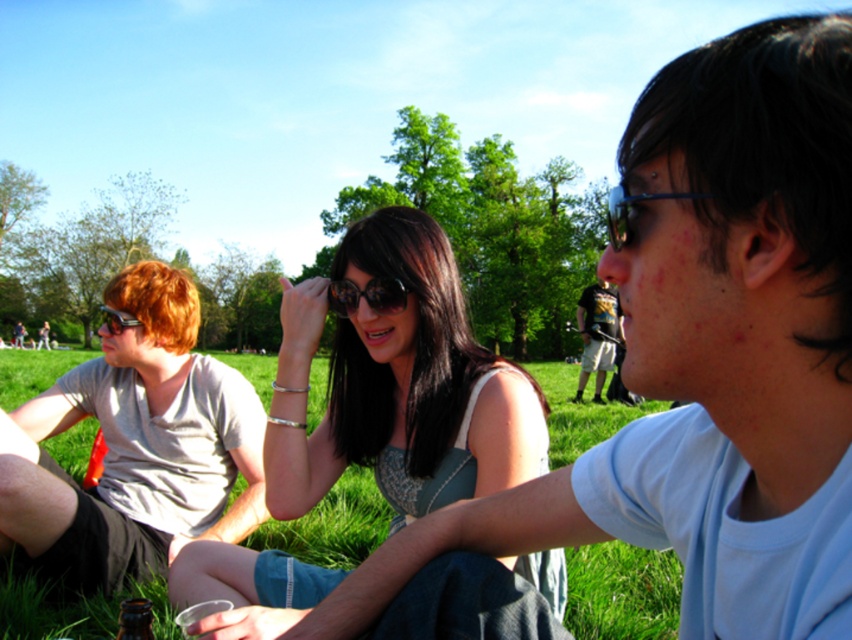
How distant is matte black sunglasses at center from green grass at center?

matte black sunglasses at center and green grass at center are 11.76 feet apart.

Is matte black sunglasses at center to the right of green grass at center from the viewer's perspective?

Correct, you'll find matte black sunglasses at center to the right of green grass at center.

Who is more distant from viewer, (383,390) or (326,548)?

The point (326,548) is more distant.

The height and width of the screenshot is (640, 852). I want to click on matte black sunglasses at center, so click(398, 385).

How far apart are dark blue jeans at center and black reflective sunglasses at center?

A distance of 30.95 feet exists between dark blue jeans at center and black reflective sunglasses at center.

Does dark blue jeans at center lie in front of black reflective sunglasses at center?

No, it is behind black reflective sunglasses at center.

Find the location of a particular element. dark blue jeans at center is located at coordinates (596, 333).

Does matte black sunglasses at center appear under dark blue jeans at center?

Yes, matte black sunglasses at center is below dark blue jeans at center.

Locate an element on the screen. matte black sunglasses at center is located at coordinates (398, 385).